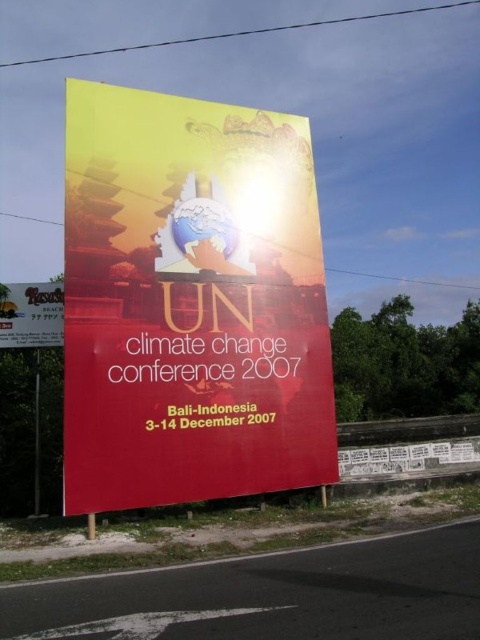
Question: Which of the following is the closest to the observer?

Choices:
 (A) yellow matte signboard at upper center
 (B) matte yellow poster at center

Answer: (B)

Question: Is matte yellow poster at center smaller than yellow matte signboard at upper center?

Choices:
 (A) yes
 (B) no

Answer: (A)

Question: Can you confirm if matte yellow poster at center is smaller than yellow matte signboard at upper center?

Choices:
 (A) yes
 (B) no

Answer: (A)

Question: Is matte yellow poster at center to the right of yellow matte signboard at upper center from the viewer's perspective?

Choices:
 (A) yes
 (B) no

Answer: (A)